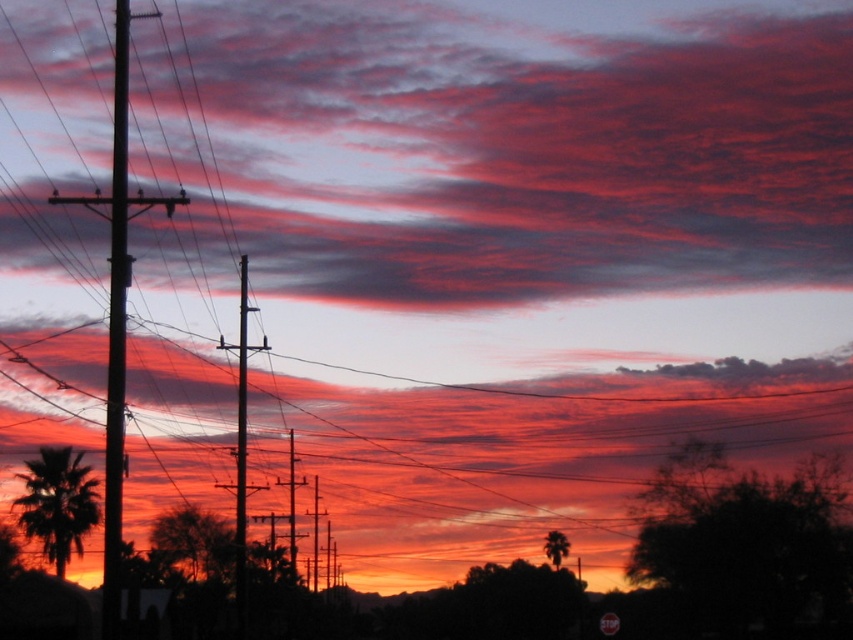
Consider the image. You are a drone operator planning to fly a drone with a wingspan of 1.5 meters between the matte red cloud at upper center and the smooth wood telegraph pole at left. Can the drone safely pass through the space between them without touching either object?

The distance between the matte red cloud at upper center and the smooth wood telegraph pole at left is 60.15 meters, which is significantly larger than the drone wingspan of 1.5 meters. The drone can safely pass through the space between them without any issues.